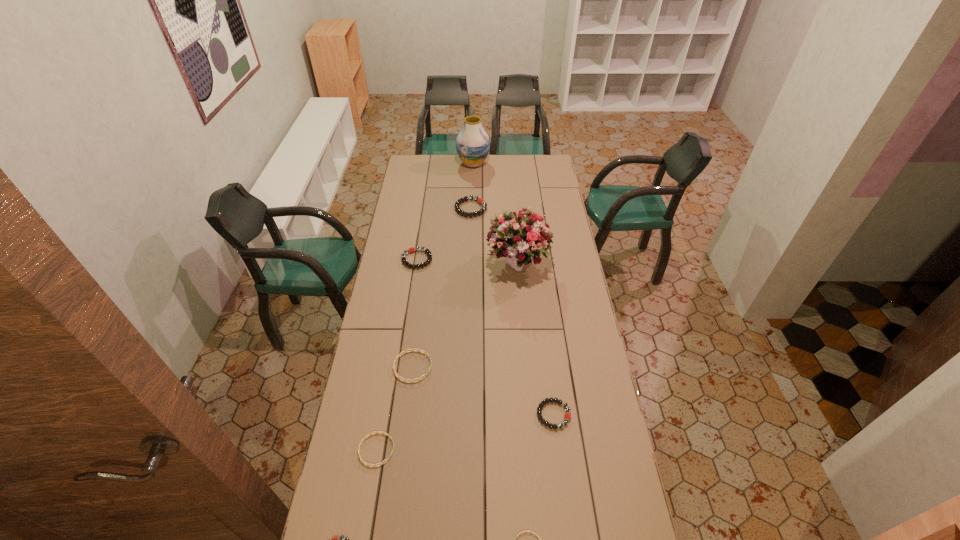
Locate an element on the screen. This screenshot has width=960, height=540. the fifth farthest bracelet is located at coordinates (374, 465).

Locate an element on the screen. The width and height of the screenshot is (960, 540). the second farthest blue bracelet is located at coordinates (374, 465).

At what (x,y) coordinates should I click in order to perform the action: click on free space located on the front of the vase. Please return your answer as a coordinate pair (x, y). Looking at the image, I should click on (472, 211).

What are the coordinates of `vacant space located 0.290m on the back of the pink bouquet` in the screenshot? It's located at (514, 208).

This screenshot has height=540, width=960. In order to click on vacant space situated on the right of the farthest bracelet in this screenshot , I will do `click(533, 208)`.

The height and width of the screenshot is (540, 960). Identify the location of free space located 0.250m on the back of the second farthest bracelet. (422, 218).

Identify the location of free space located on the surface of the third farthest bracelet showing star-shaped elements. The height and width of the screenshot is (540, 960). (513, 367).

The width and height of the screenshot is (960, 540). I want to click on vacant position located on the front of the sixth farthest object, so click(x=568, y=528).

Identify the location of free spot located on the surface of the second farthest blue bracelet showing star-shaped elements. (421, 450).

You are a GUI agent. You are given a task and a screenshot of the screen. Output one action in this format:
    pyautogui.click(x=<x>, y=<y>)
    Task: Click on the object situated at the far edge
    This screenshot has height=540, width=960.
    Given the screenshot: What is the action you would take?
    pyautogui.click(x=472, y=144)